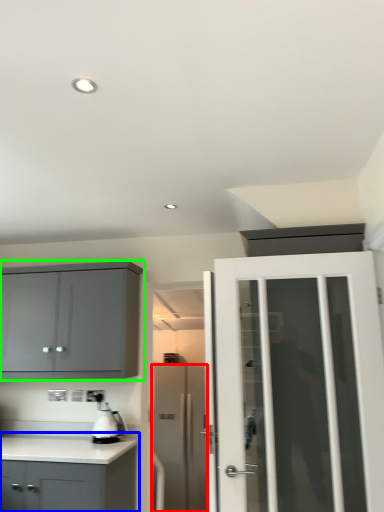
Question: Which object is positioned closest to door (highlighted by a red box)? Select from cabinetry (highlighted by a blue box) and cabinetry (highlighted by a green box).

Choices:
 (A) cabinetry
 (B) cabinetry

Answer: (A)